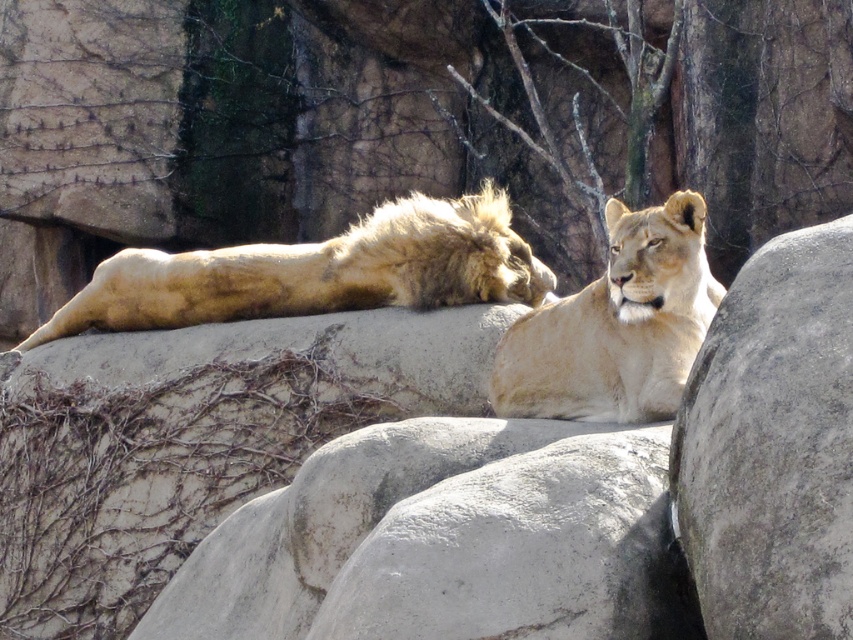
Question: Which is farther from the light brown fur lioness at center?

Choices:
 (A) gray rough boulder at center
 (B) golden fur lion at center
 (C) gray rough boulder at right

Answer: (B)

Question: Is gray rough boulder at center thinner than light brown fur lioness at center?

Choices:
 (A) yes
 (B) no

Answer: (B)

Question: Can you confirm if gray rough boulder at right is smaller than light brown fur lioness at center?

Choices:
 (A) no
 (B) yes

Answer: (B)

Question: Estimate the real-world distances between objects in this image. Which object is farther from the gray rough boulder at right?

Choices:
 (A) golden fur lion at center
 (B) gray rough boulder at center
 (C) light brown fur lioness at center

Answer: (A)

Question: Which is farther from the gray rough boulder at center?

Choices:
 (A) golden fur lion at center
 (B) gray rough boulder at right

Answer: (A)

Question: Can you confirm if gray rough boulder at right is positioned to the left of light brown fur lioness at center?

Choices:
 (A) yes
 (B) no

Answer: (B)